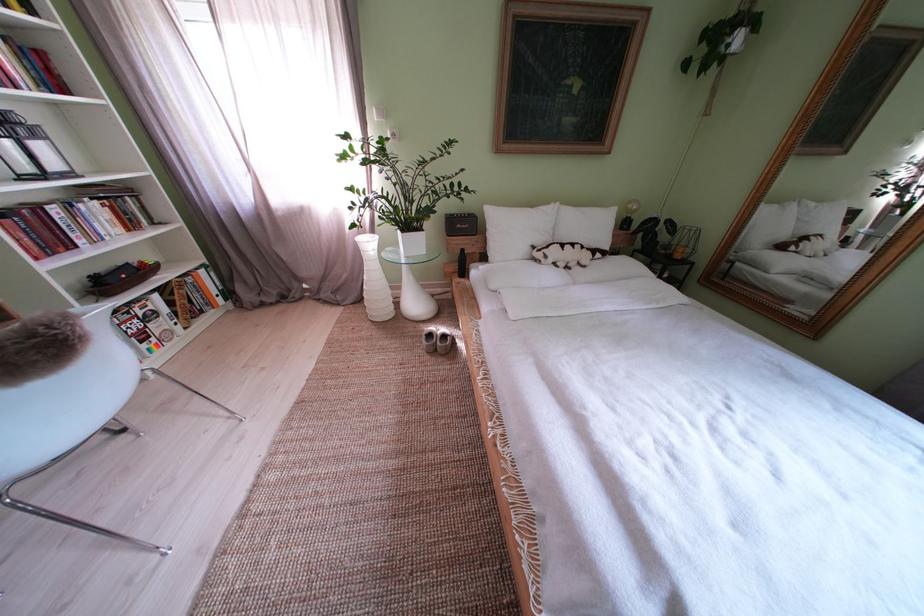
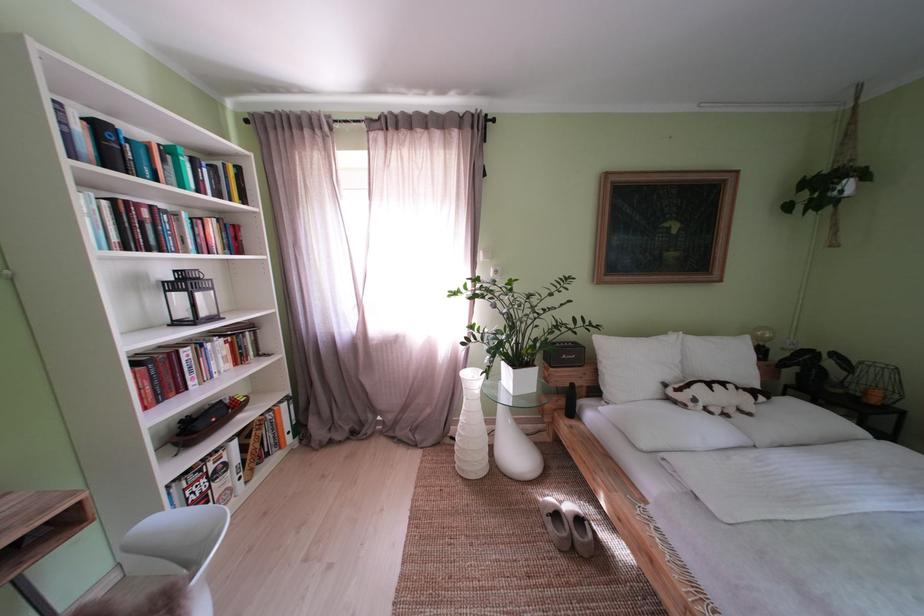
In the second image, find the point that corresponds to (x=67, y=216) in the first image.

(199, 359)